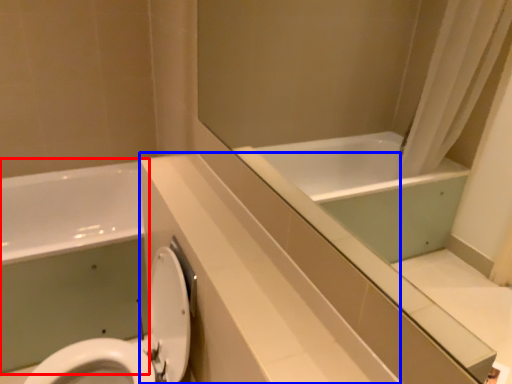
Question: Which object appears farthest to the camera in this image, bath (highlighted by a red box) or counter top (highlighted by a blue box)?

Choices:
 (A) bath
 (B) counter top

Answer: (A)